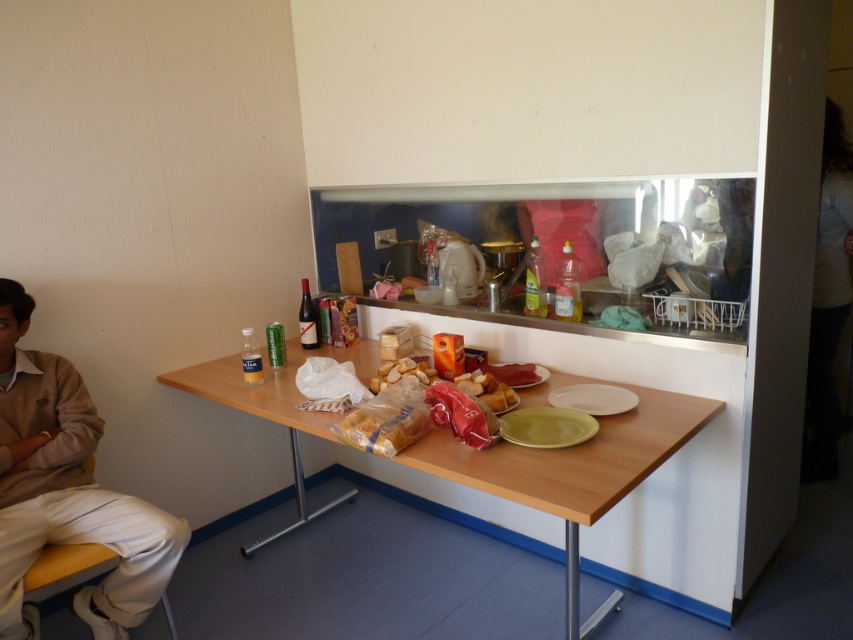
How much distance is there between golden brown bread at center and matte yellow plate at center?

golden brown bread at center and matte yellow plate at center are 7.37 inches apart.

This screenshot has width=853, height=640. I want to click on golden brown bread at center, so click(x=486, y=388).

Is golden bread loaf at center further to the viewer compared to matte yellow plate at center?

No.

This screenshot has width=853, height=640. Find the location of `golden bread loaf at center`. golden bread loaf at center is located at coordinates (383, 426).

Can you confirm if green matte plate at center is thinner than matte brown bread at center?

Incorrect, green matte plate at center's width is not less than matte brown bread at center's.

At what (x,y) coordinates should I click in order to perform the action: click on green matte plate at center. Please return your answer as a coordinate pair (x, y). The image size is (853, 640). Looking at the image, I should click on (546, 426).